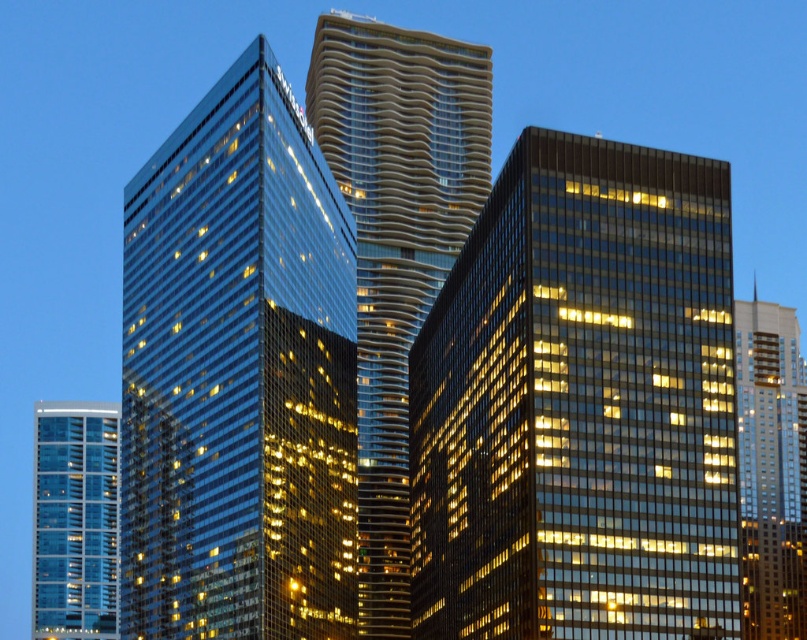
You are an architect evaluating the cityscape. Which of the two buildings, the glossy glass building at center or the transparent glass building at lower left, would require more structural support due to its height?

The glossy glass building at center requires more structural support because it is taller than the transparent glass building at lower left.

Looking at this image, you are a city planner reviewing the urban layout. You notice the glassy reflective tower at center and the glossy glass building at center. Which one is positioned to the left side of the other?

The glassy reflective tower at center is to the left of the glossy glass building at center.